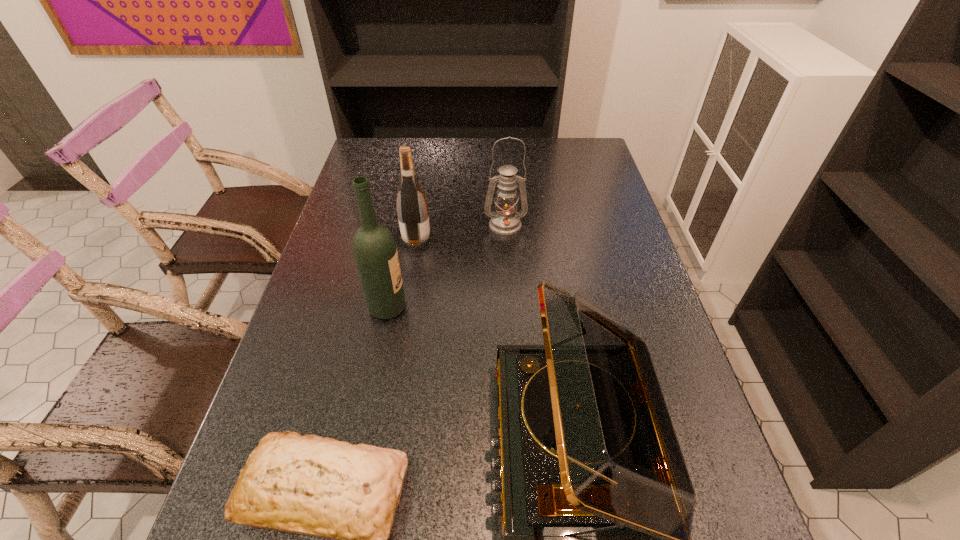
You are a GUI agent. You are given a task and a screenshot of the screen. Output one action in this format:
    pyautogui.click(x=<x>, y=<y>)
    Task: Click on the free space at the far left corner of the desktop
    The image size is (960, 540).
    Given the screenshot: What is the action you would take?
    pyautogui.click(x=383, y=147)

Find the location of a particular element. unoccupied area between the shorter wine bottle and the oil lamp is located at coordinates (461, 233).

Locate an element on the screen. The width and height of the screenshot is (960, 540). vacant area between the tallest object and the shorter wine bottle is located at coordinates click(x=402, y=274).

You are a GUI agent. You are given a task and a screenshot of the screen. Output one action in this format:
    pyautogui.click(x=<x>, y=<y>)
    Task: Click on the vacant area that lies between the oil lamp and the shorter wine bottle
    The width and height of the screenshot is (960, 540).
    Given the screenshot: What is the action you would take?
    pyautogui.click(x=461, y=233)

In order to click on object identified as the third closest to the bread in this screenshot , I will do `click(412, 209)`.

Select which object appears as the closest to the record player. Please provide its 2D coordinates. Your answer should be formatted as a tuple, i.e. [(x, y)], where the tuple contains the x and y coordinates of a point satisfying the conditions above.

[(320, 487)]